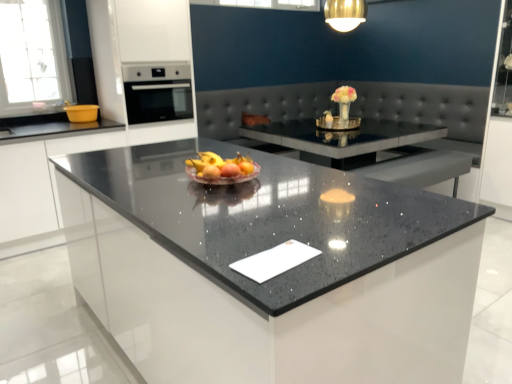
I want to click on translucent glass bowl at center, so click(221, 169).

What do you see at coordinates (40, 179) in the screenshot?
I see `white glossy cabinet at left, the 1th cabinetry viewed from the left` at bounding box center [40, 179].

The width and height of the screenshot is (512, 384). In order to click on glossy white oven at upper left, which is the 2th cabinetry from left to right in this screenshot , I will do `click(134, 44)`.

At what (x,y) coordinates should I click in order to perform the action: click on translucent glass bowl at center. Please return your answer as a coordinate pair (x, y). The image size is (512, 384). Looking at the image, I should click on (221, 169).

Is black granite countertop at center at the back of white glossy cabinet at left, the 1th cabinetry viewed from the left?

No.

Considering the positions of points (16, 174) and (351, 190), is point (16, 174) farther from camera compared to point (351, 190)?

Yes, point (16, 174) is behind point (351, 190).

Where is `countertop below the white glossy cabinet at left, the 1th cabinetry viewed from the left (from the image's perspective)`? countertop below the white glossy cabinet at left, the 1th cabinetry viewed from the left (from the image's perspective) is located at coordinates (267, 216).

How different are the orientations of white glossy cabinet at left, the 1th cabinetry viewed from the left, and black granite countertop at center in degrees?

The facing directions of white glossy cabinet at left, the 1th cabinetry viewed from the left, and black granite countertop at center are 90.6 degrees apart.

From the image's perspective, is satin black oven at upper left below black granite countertop at center?

Actually, satin black oven at upper left appears above black granite countertop at center in the image.

Is satin black oven at upper left not near black granite countertop at center?

Yes, satin black oven at upper left and black granite countertop at center are located far from each other.

Which is more to the right, satin black oven at upper left or black granite countertop at center?

Positioned to the right is black granite countertop at center.

Is satin black oven at upper left in front of or behind black granite countertop at center in the image?

satin black oven at upper left is behind black granite countertop at center.

Is the surface of satin black oven at upper left in direct contact with yellow plastic bowl at left?

No, satin black oven at upper left is not in contact with yellow plastic bowl at left.

Which is behind, point (138, 95) or point (67, 110)?

Positioned behind is point (67, 110).

From a real-world perspective, is satin black oven at upper left physically located above or below yellow plastic bowl at left?

In terms of real-world spatial position, satin black oven at upper left is above yellow plastic bowl at left.

Measure the distance from satin black oven at upper left to yellow plastic bowl at left.

They are 20.75 inches apart.

Is black granite countertop at center situated inside gold metallic light fixture at upper center or outside?

black granite countertop at center exists outside the volume of gold metallic light fixture at upper center.

Is point (387, 198) closer or farther from the camera than point (337, 20)?

Clearly, point (387, 198) is closer to the camera than point (337, 20).

Is black granite countertop at center behind gold metallic light fixture at upper center?

That is False.

Who is bigger, black granite countertop at center or gold metallic light fixture at upper center?

black granite countertop at center is bigger.

Which is farther, (x=34, y=188) or (x=82, y=120)?

The point (x=82, y=120) is farther.

Is white glossy cabinet at left, the 1th cabinetry viewed from the left, looking in the opposite direction of yellow plastic bowl at left?

No.

Is white glossy cabinet at left, marked as the 2th cabinetry in a right-to-left arrangement, situated inside yellow plastic bowl at left or outside?

white glossy cabinet at left, marked as the 2th cabinetry in a right-to-left arrangement, lies outside yellow plastic bowl at left.

Locate an element on the screen. Image resolution: width=512 pixels, height=384 pixels. cabinetry below the yellow plastic bowl at left (from a real-world perspective) is located at coordinates (40, 179).

Can you confirm if gold metallic light fixture at upper center is wider than black granite countertop at center?

Incorrect, the width of gold metallic light fixture at upper center does not surpass that of black granite countertop at center.

Who is shorter, gold metallic light fixture at upper center or black granite countertop at center?

With less height is gold metallic light fixture at upper center.

From the image's perspective, between gold metallic light fixture at upper center and black granite countertop at center, which one is located above?

gold metallic light fixture at upper center is shown above in the image.

Locate an element on the screen. This screenshot has width=512, height=384. countertop that is on the left side of gold metallic light fixture at upper center is located at coordinates (267, 216).

Is yellow plastic bowl at left a part of gold metallic light fixture at upper center?

No, yellow plastic bowl at left is located outside of gold metallic light fixture at upper center.

Which of these two, gold metallic light fixture at upper center or yellow plastic bowl at left, is smaller?

Smaller between the two is yellow plastic bowl at left.

Which object is more forward, gold metallic light fixture at upper center or yellow plastic bowl at left?

gold metallic light fixture at upper center is closer to the camera.

Which cabinetry is the 2nd one when counting from the left side of the black granite countertop at center? Please provide its 2D coordinates.

[(40, 179)]

The width and height of the screenshot is (512, 384). Find the location of `countertop in front of the satin black oven at upper left`. countertop in front of the satin black oven at upper left is located at coordinates (267, 216).

Considering their positions, is yellow plastic bowl at left positioned further to white glossy cabinet at left, marked as the 2th cabinetry in a right-to-left arrangement, than glossy white oven at upper left, which ranks as the 1th cabinetry in right-to-left order?

Based on the image, glossy white oven at upper left, which ranks as the 1th cabinetry in right-to-left order, appears to be further to white glossy cabinet at left, marked as the 2th cabinetry in a right-to-left arrangement.

Estimate the real-world distances between objects in this image. Which object is closer to gold metallic light fixture at upper center, satin black oven at upper left or translucent glass bowl at center?

satin black oven at upper left is closer to gold metallic light fixture at upper center.

Consider the image. Which object lies further to the anchor point black granite countertop at center, gold metallic light fixture at upper center or satin black oven at upper left?

The object further to black granite countertop at center is gold metallic light fixture at upper center.

Estimate the real-world distances between objects in this image. Which object is closer to yellow plastic bowl at left, glossy white oven at upper left, which is the 2th cabinetry from left to right, or white glossy cabinet at left, marked as the 2th cabinetry in a right-to-left arrangement?

The object closer to yellow plastic bowl at left is white glossy cabinet at left, marked as the 2th cabinetry in a right-to-left arrangement.

Based on their spatial positions, is glossy white oven at upper left, which is the 2th cabinetry from left to right, or white glossy cabinet at left, the 1th cabinetry viewed from the left, further from satin black oven at upper left?

white glossy cabinet at left, the 1th cabinetry viewed from the left, lies further to satin black oven at upper left than the other object.

Looking at the image, which one is located further to white glossy cabinet at left, marked as the 2th cabinetry in a right-to-left arrangement, translucent glass bowl at center or glossy white oven at upper left, which ranks as the 1th cabinetry in right-to-left order?

translucent glass bowl at center.

Considering their positions, is yellow plastic bowl at left positioned further to satin black oven at upper left than translucent glass bowl at center?

translucent glass bowl at center is further to satin black oven at upper left.

Based on their spatial positions, is glossy white oven at upper left, which is the 2th cabinetry from left to right, or black granite countertop at center closer to translucent glass bowl at center?

black granite countertop at center is closer to translucent glass bowl at center.

This screenshot has width=512, height=384. I want to click on fruit dish positioned between black granite countertop at center and glossy white oven at upper left, which is the 2th cabinetry from left to right, from near to far, so click(221, 169).

Where is `cabinetry between black granite countertop at center and glossy white oven at upper left, which ranks as the 1th cabinetry in right-to-left order, from front to back`? cabinetry between black granite countertop at center and glossy white oven at upper left, which ranks as the 1th cabinetry in right-to-left order, from front to back is located at coordinates (40, 179).

The image size is (512, 384). I want to click on home appliance between translucent glass bowl at center and gold metallic light fixture at upper center along the z-axis, so click(x=157, y=91).

Locate an element on the screen. This screenshot has width=512, height=384. home appliance between black granite countertop at center and yellow plastic bowl at left along the z-axis is located at coordinates (157, 91).